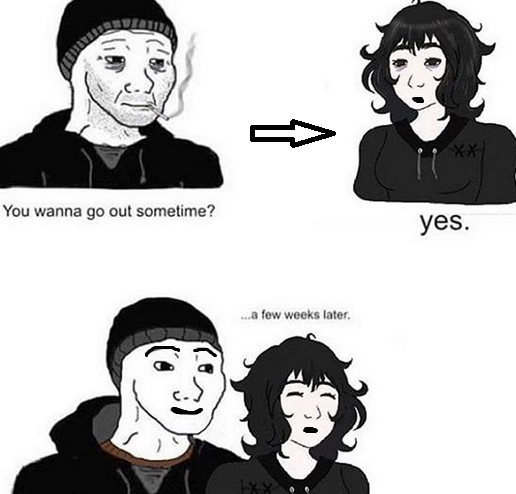
Image resolution: width=516 pixels, height=494 pixels. Identify the location of hoods. (47, 157), (458, 162), (268, 479), (64, 470).